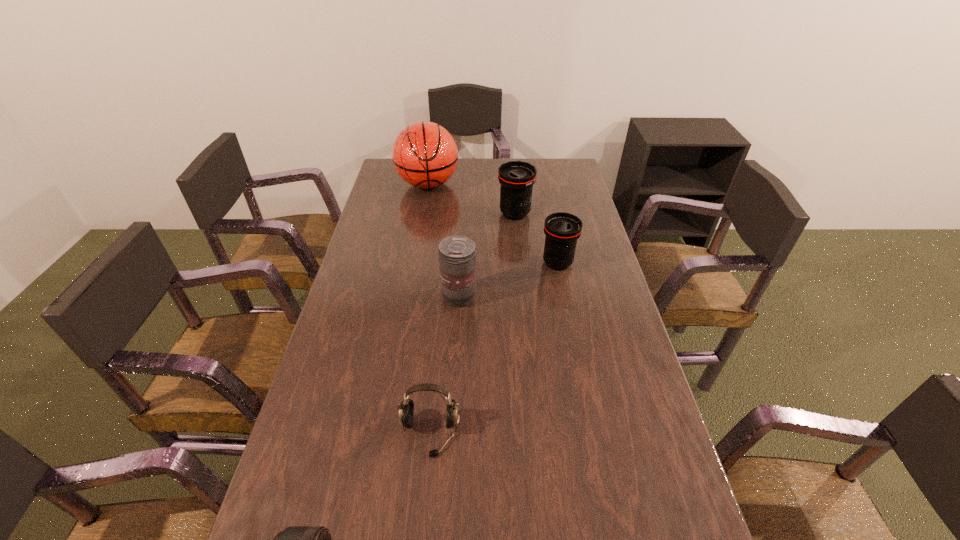
This screenshot has height=540, width=960. In order to click on basketball in this screenshot , I will do `click(425, 155)`.

Locate an element on the screen. The height and width of the screenshot is (540, 960). the tallest object is located at coordinates (425, 155).

Locate an element on the screen. The height and width of the screenshot is (540, 960). the second nearest telephoto lens is located at coordinates (456, 254).

This screenshot has width=960, height=540. Find the location of `the third nearest object`. the third nearest object is located at coordinates point(456,254).

Where is `the fifth nearest object`? The height and width of the screenshot is (540, 960). the fifth nearest object is located at coordinates (516, 178).

Locate an element on the screen. the second farthest telephoto lens is located at coordinates (562, 230).

Where is `headset`? The image size is (960, 540). headset is located at coordinates (406, 408).

Where is `free space located 0.100m on the side with spill of the tallest object`? free space located 0.100m on the side with spill of the tallest object is located at coordinates (422, 215).

At what (x,y) coordinates should I click in order to perform the action: click on free space located 0.330m on the side of the third nearest object where the control switches are located. Please return your answer as a coordinate pair (x, y). Image resolution: width=960 pixels, height=540 pixels. Looking at the image, I should click on (586, 298).

Identify the location of free location located 0.290m on the back of the fifth nearest object. This screenshot has height=540, width=960. (510, 168).